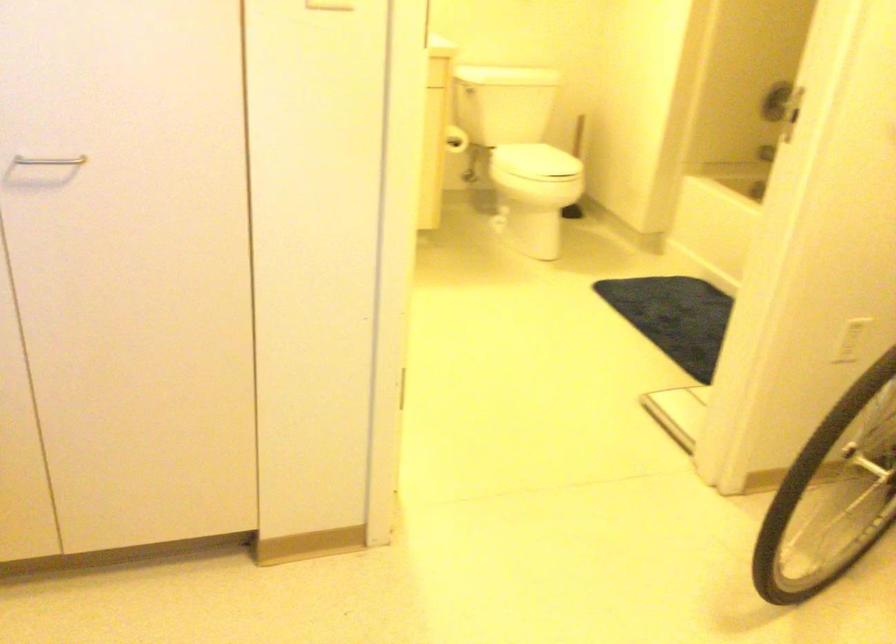
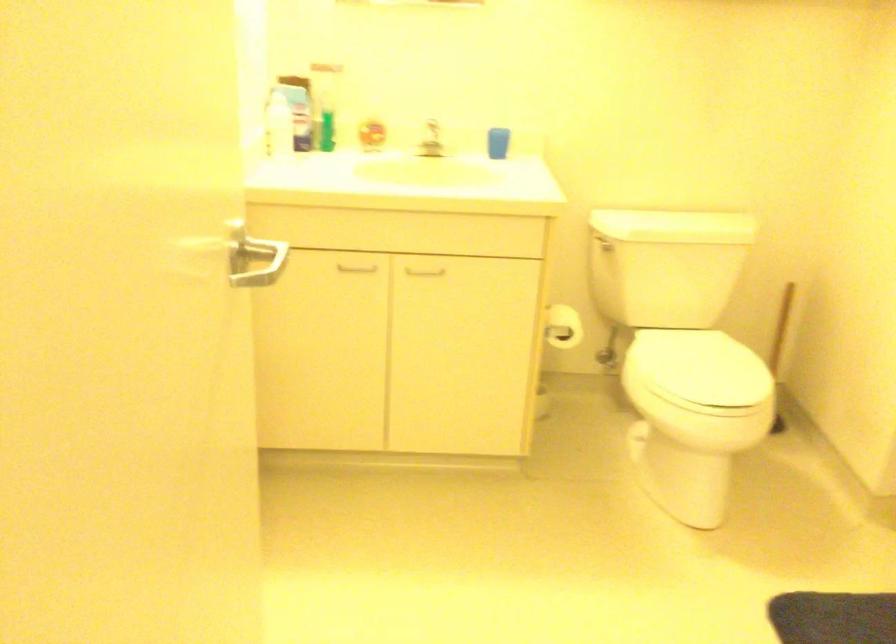
In the second image, find the point that corresponds to (537,155) in the first image.

(696, 368)